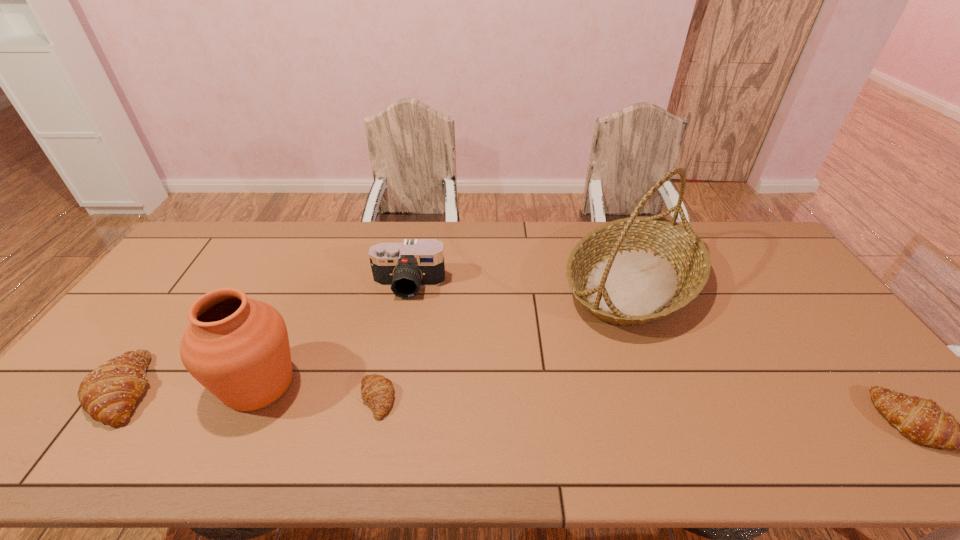
Locate an element on the screen. The image size is (960, 540). vacant space at the right edge of the desktop is located at coordinates (784, 332).

At what (x,y) coordinates should I click in order to perform the action: click on free space at the far left corner of the desktop. Please return your answer as a coordinate pair (x, y). Image resolution: width=960 pixels, height=540 pixels. Looking at the image, I should click on (247, 229).

This screenshot has width=960, height=540. What are the coordinates of `vacant area between the third tallest object and the fifth object from right to left` in the screenshot? It's located at (334, 335).

Where is `vacant point located between the leftmost crescent roll and the fifth object from right to left`? Image resolution: width=960 pixels, height=540 pixels. vacant point located between the leftmost crescent roll and the fifth object from right to left is located at coordinates (192, 387).

Find the location of a particular element. free space between the camera and the second crescent roll from right to left is located at coordinates (393, 342).

Identify the location of free spot between the fifth object from left to right and the second crescent roll from right to left. The image size is (960, 540). (505, 341).

Where is `vacant area that lies between the urn and the fifth object from left to right`? vacant area that lies between the urn and the fifth object from left to right is located at coordinates (445, 334).

You are a GUI agent. You are given a task and a screenshot of the screen. Output one action in this format:
    pyautogui.click(x=<x>, y=<y>)
    Task: Click on the empty space between the tallest object and the urn
    Image resolution: width=960 pixels, height=540 pixels.
    Given the screenshot: What is the action you would take?
    tap(445, 334)

This screenshot has width=960, height=540. I want to click on free space between the second crescent roll from left to right and the second object from right to left, so click(x=505, y=341).

Locate an element on the screen. The image size is (960, 540). free space that is in between the second object from right to left and the second crescent roll from right to left is located at coordinates click(x=505, y=341).